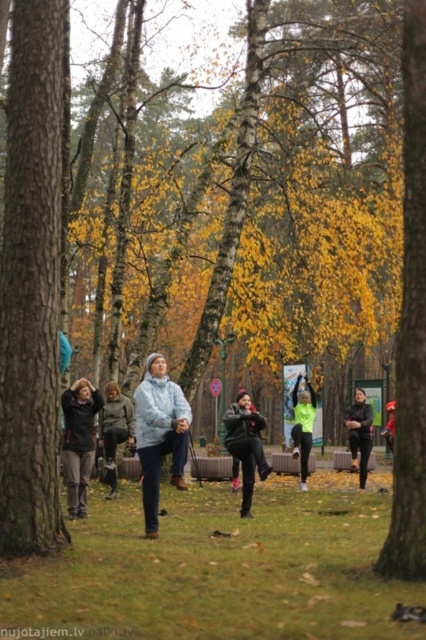
You are standing in the park and see the neon green fabric at center. Where exactly is it located in terms of coordinates?

The neon green fabric at center is located at coordinates point (302, 424).